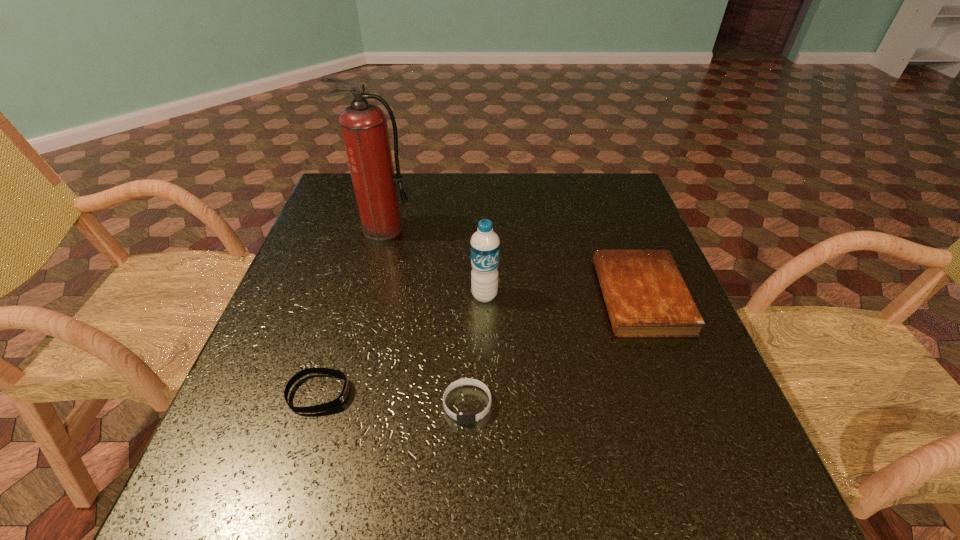
Locate an element on the screen. The image size is (960, 540). free region at the left edge of the desktop is located at coordinates (342, 249).

Locate an element on the screen. free space at the far left corner of the desktop is located at coordinates (352, 201).

Find the location of `free region at the far right corner of the desktop`. free region at the far right corner of the desktop is located at coordinates (615, 173).

In the image, there is a desktop. Find the location of `vacant space at the near right corner`. vacant space at the near right corner is located at coordinates (753, 518).

Find the location of `free space that is in between the farthest object and the rightmost object`. free space that is in between the farthest object and the rightmost object is located at coordinates (512, 263).

At what (x,y) coordinates should I click in order to perform the action: click on unoccupied position between the farthest object and the shortest object. Please return your answer as a coordinate pair (x, y). Looking at the image, I should click on (351, 312).

You are a GUI agent. You are given a task and a screenshot of the screen. Output one action in this format:
    pyautogui.click(x=<x>, y=<y>)
    Task: Click on the empty location between the taller wristband and the fire extinguisher
    
    Given the screenshot: What is the action you would take?
    pyautogui.click(x=425, y=317)

This screenshot has height=540, width=960. I want to click on free space between the second tallest object and the shortest object, so click(402, 345).

You are a GUI agent. You are given a task and a screenshot of the screen. Output one action in this format:
    pyautogui.click(x=<x>, y=<y>)
    Task: Click on the free area in between the right wristband and the tallest object
    The height and width of the screenshot is (540, 960).
    Given the screenshot: What is the action you would take?
    pyautogui.click(x=425, y=317)

I want to click on unoccupied position between the rightmost object and the fire extinguisher, so click(x=512, y=263).